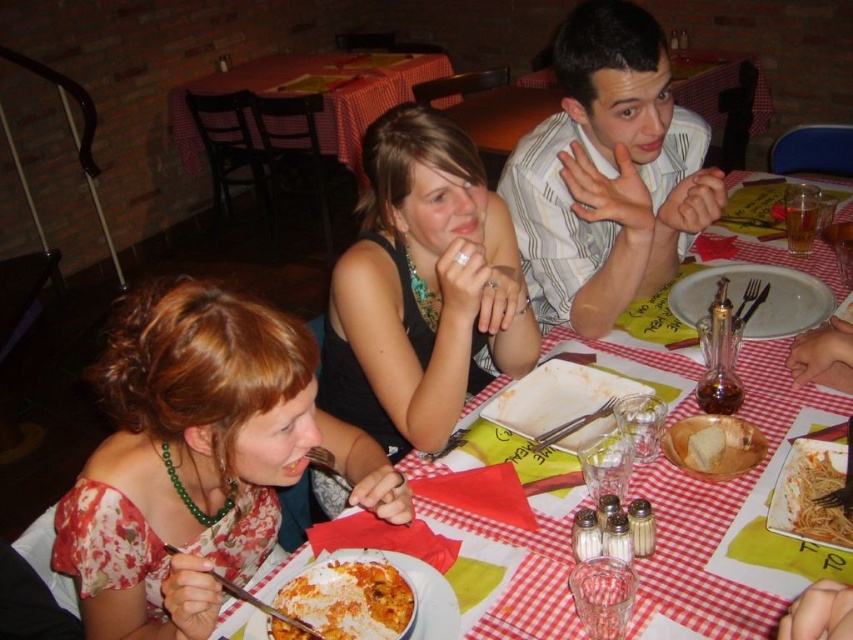
Can you confirm if white porcelain plate at center is positioned above white glossy pasta at center?

Yes.

Is white porcelain plate at center thinner than white glossy pasta at center?

Incorrect, white porcelain plate at center's width is not less than white glossy pasta at center's.

The image size is (853, 640). I want to click on white porcelain plate at center, so click(759, 304).

Who is higher up, red checkered tablecloth at center or checkered fabric table at center?

checkered fabric table at center is above.

Is point (680, 552) farther from viewer compared to point (184, 93)?

That is False.

Find the location of a particular element. Image resolution: width=853 pixels, height=640 pixels. red checkered tablecloth at center is located at coordinates (697, 557).

Does checkered fabric table at center appear on the left side of white glossy pasta at center?

Correct, you'll find checkered fabric table at center to the left of white glossy pasta at center.

Which of these two, checkered fabric table at center or white glossy pasta at center, stands shorter?

white glossy pasta at center

You are a GUI agent. You are given a task and a screenshot of the screen. Output one action in this format:
    pyautogui.click(x=<x>, y=<y>)
    Task: Click on the checkered fabric table at center
    This screenshot has width=853, height=640.
    Given the screenshot: What is the action you would take?
    pyautogui.click(x=312, y=93)

Locate an element on the screen. The height and width of the screenshot is (640, 853). checkered fabric table at center is located at coordinates [312, 93].